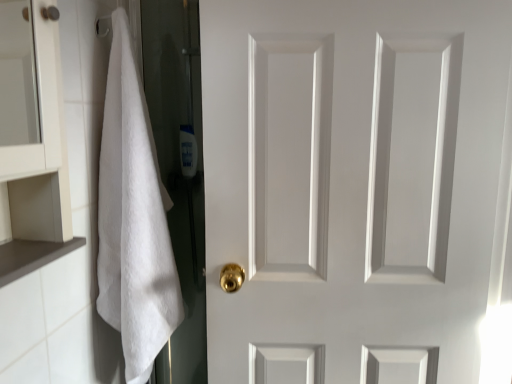
Question: Considering the relative sizes of brown matte cabinet at lower left and white fluffy towel at left in the image provided, is brown matte cabinet at lower left wider than white fluffy towel at left?

Choices:
 (A) no
 (B) yes

Answer: (A)

Question: Is brown matte cabinet at lower left smaller than white fluffy towel at left?

Choices:
 (A) no
 (B) yes

Answer: (B)

Question: Is brown matte cabinet at lower left shorter than white fluffy towel at left?

Choices:
 (A) no
 (B) yes

Answer: (B)

Question: Is brown matte cabinet at lower left surrounding white fluffy towel at left?

Choices:
 (A) yes
 (B) no

Answer: (B)

Question: From the image's perspective, is brown matte cabinet at lower left on top of white fluffy towel at left?

Choices:
 (A) yes
 (B) no

Answer: (B)

Question: Considering the relative sizes of brown matte cabinet at lower left and white fluffy towel at left in the image provided, is brown matte cabinet at lower left thinner than white fluffy towel at left?

Choices:
 (A) yes
 (B) no

Answer: (A)

Question: Is translucent plastic bottle at center outside white matte door at center?

Choices:
 (A) yes
 (B) no

Answer: (A)

Question: From a real-world perspective, is translucent plastic bottle at center on white matte door at center?

Choices:
 (A) yes
 (B) no

Answer: (A)

Question: Is translucent plastic bottle at center next to white matte door at center and touching it?

Choices:
 (A) no
 (B) yes

Answer: (A)

Question: Does translucent plastic bottle at center have a greater width compared to white matte door at center?

Choices:
 (A) yes
 (B) no

Answer: (B)

Question: Is translucent plastic bottle at center facing away from white matte door at center?

Choices:
 (A) no
 (B) yes

Answer: (A)

Question: Is translucent plastic bottle at center bigger than white matte door at center?

Choices:
 (A) no
 (B) yes

Answer: (A)

Question: From a real-world perspective, does white fluffy towel at left stand above translucent plastic bottle at center?

Choices:
 (A) yes
 (B) no

Answer: (B)